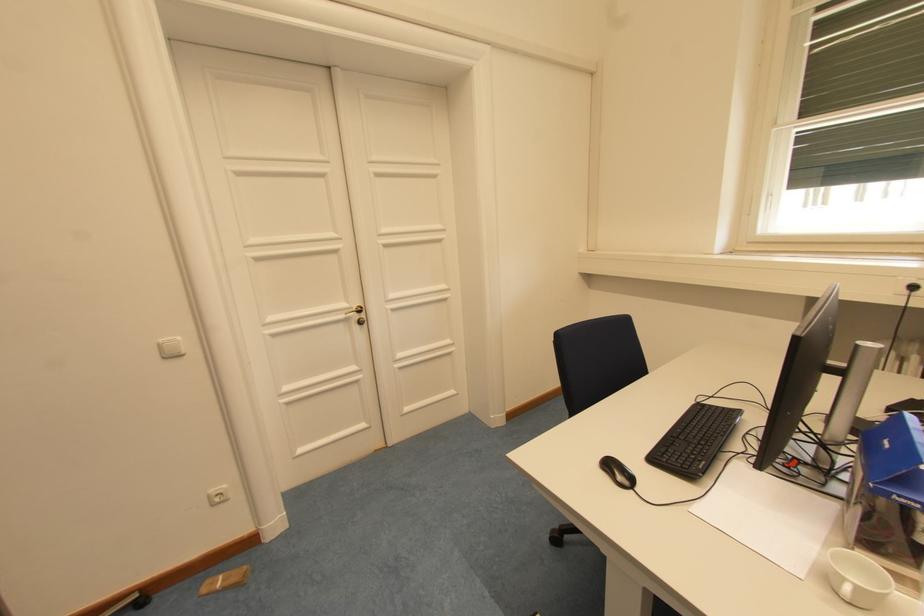
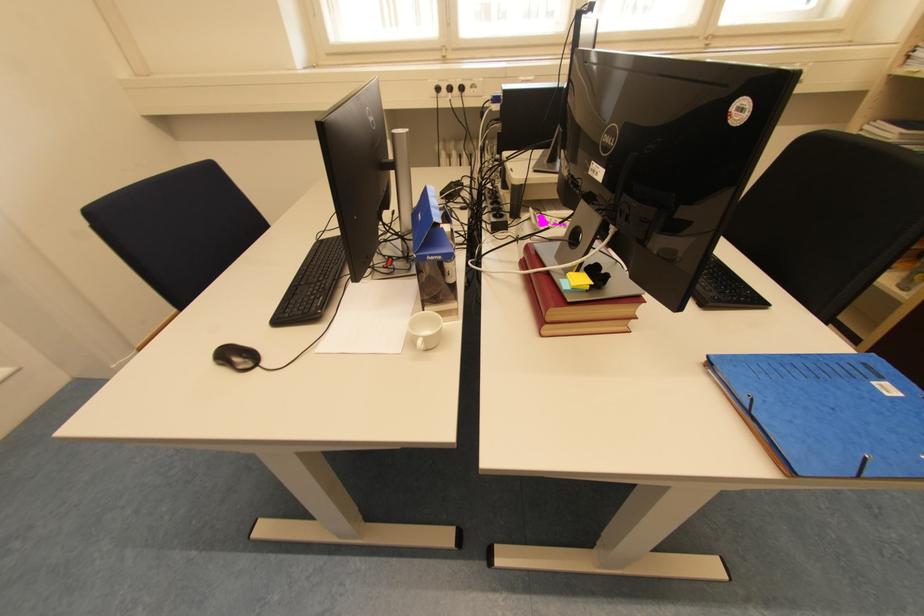
Based on the continuous images, in which direction is the camera rotating?

The rotation direction of the camera is right-down.